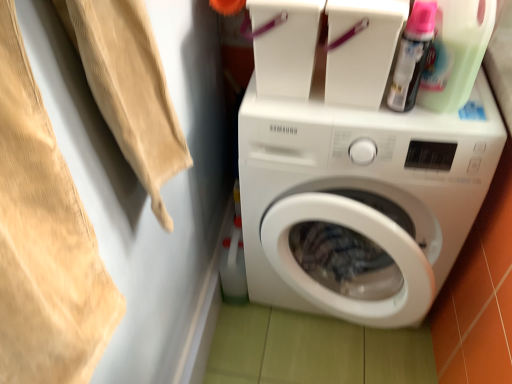
Question: Does translucent plastic spray can at upper right, the 2th cleaning product positioned from the right, lie in front of green translucent bottle at upper right, placed as the 2th cleaning product when sorted from left to right?

Choices:
 (A) no
 (B) yes

Answer: (A)

Question: Does translucent plastic spray can at upper right, which is counted as the first cleaning product, starting from the left, have a larger size compared to green translucent bottle at upper right, marked as the first cleaning product in a right-to-left arrangement?

Choices:
 (A) no
 (B) yes

Answer: (A)

Question: Does translucent plastic spray can at upper right, which is counted as the first cleaning product, starting from the left, lie behind green translucent bottle at upper right, marked as the first cleaning product in a right-to-left arrangement?

Choices:
 (A) yes
 (B) no

Answer: (A)

Question: Is translucent plastic spray can at upper right, the 2th cleaning product positioned from the right, outside green translucent bottle at upper right, marked as the first cleaning product in a right-to-left arrangement?

Choices:
 (A) yes
 (B) no

Answer: (B)

Question: Are translucent plastic spray can at upper right, which is counted as the first cleaning product, starting from the left, and green translucent bottle at upper right, placed as the 2th cleaning product when sorted from left to right, beside each other?

Choices:
 (A) yes
 (B) no

Answer: (A)

Question: Is white glossy washing machine at center bigger or smaller than translucent plastic spray can at upper right, which is counted as the first cleaning product, starting from the left?

Choices:
 (A) big
 (B) small

Answer: (A)

Question: Is white glossy washing machine at center wider or thinner than translucent plastic spray can at upper right, which is counted as the first cleaning product, starting from the left?

Choices:
 (A) wide
 (B) thin

Answer: (A)

Question: From the image's perspective, is white glossy washing machine at center located above or below translucent plastic spray can at upper right, the 2th cleaning product positioned from the right?

Choices:
 (A) below
 (B) above

Answer: (A)

Question: Is white glossy washing machine at center taller or shorter than translucent plastic spray can at upper right, the 2th cleaning product positioned from the right?

Choices:
 (A) tall
 (B) short

Answer: (A)

Question: Considering their positions, is beige cotton towel at upper left located in front of or behind white glossy washing machine at center?

Choices:
 (A) behind
 (B) front

Answer: (B)

Question: From a real-world perspective, is beige cotton towel at upper left above or below white glossy washing machine at center?

Choices:
 (A) below
 (B) above

Answer: (B)

Question: In terms of width, does beige cotton towel at upper left look wider or thinner when compared to white glossy washing machine at center?

Choices:
 (A) thin
 (B) wide

Answer: (A)

Question: Looking at the image, does beige cotton towel at upper left seem bigger or smaller compared to white glossy washing machine at center?

Choices:
 (A) small
 (B) big

Answer: (A)

Question: Considering the positions of point (395, 99) and point (339, 144), is point (395, 99) closer or farther from the camera than point (339, 144)?

Choices:
 (A) closer
 (B) farther

Answer: (A)

Question: From their relative heights in the image, would you say translucent plastic spray can at upper right, which is counted as the first cleaning product, starting from the left, is taller or shorter than white glossy washing machine at center?

Choices:
 (A) tall
 (B) short

Answer: (B)